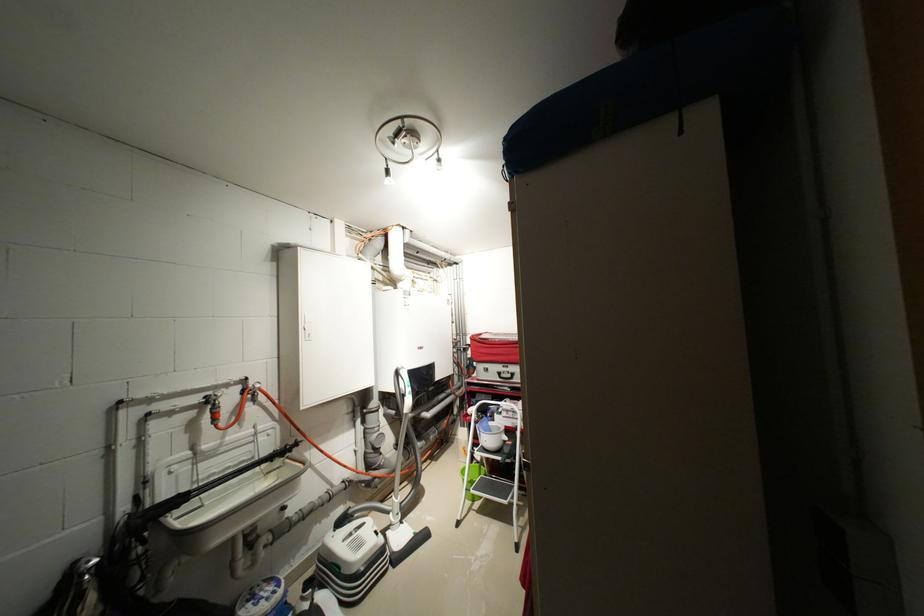
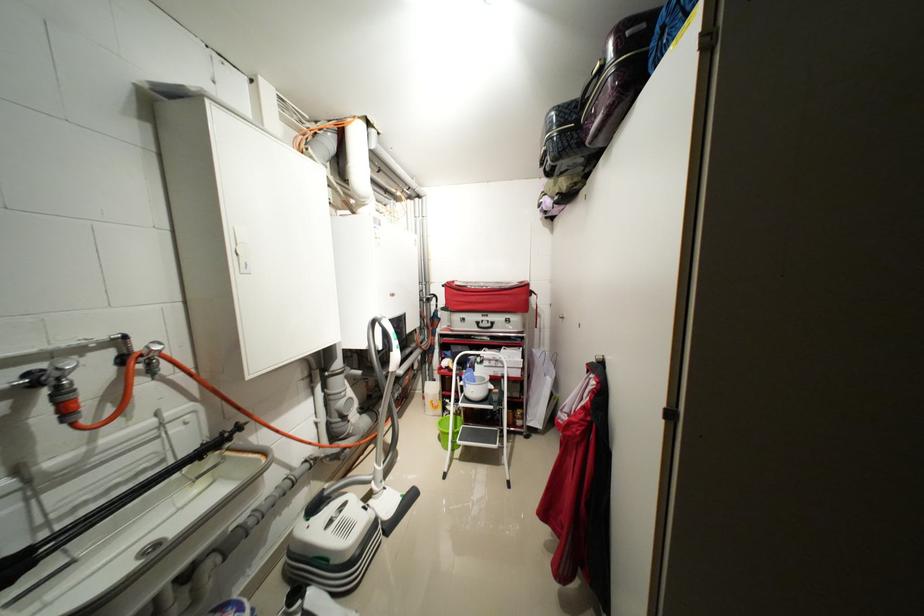
The point at [480,336] is marked in the first image. Where is the corresponding point in the second image?

(455, 284)